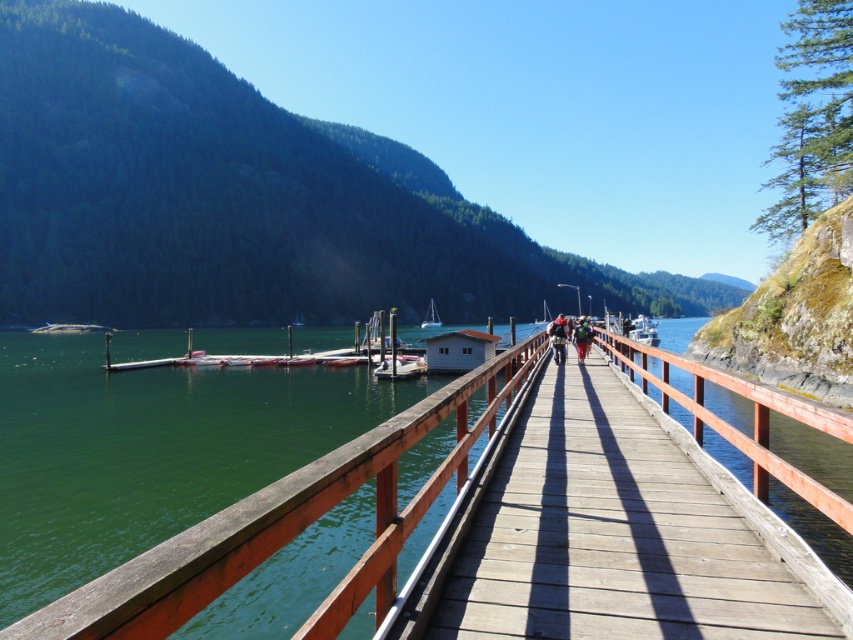
You are planning to rent a boat for a short trip. You see two boats at the center of the image, a white matte boat at center and a white glossy sailboat at center. Which one is smaller in height?

The white matte boat at center is shorter than the white glossy sailboat at center, so the white matte boat at center is smaller in height.

You are a photographer planning to take a wide shot of the waterfront scene. Given that the wooden bridge at center and the green fabric jacket at center are both in your frame, which object will occupy more of the photo space?

The wooden bridge at center occupies more space in the photo because it is larger than the green fabric jacket at center according to the description.

You are standing on the wooden bridge at center and want to hand a green fabric jacket at center to someone on the dock. In which direction should you move to place the jacket closer to the dock?

The wooden bridge at center is positioned on the left side of the green fabric jacket at center. To place the jacket closer to the dock, you should move it to the right side since the dock is likely extending in that direction from the jacket.